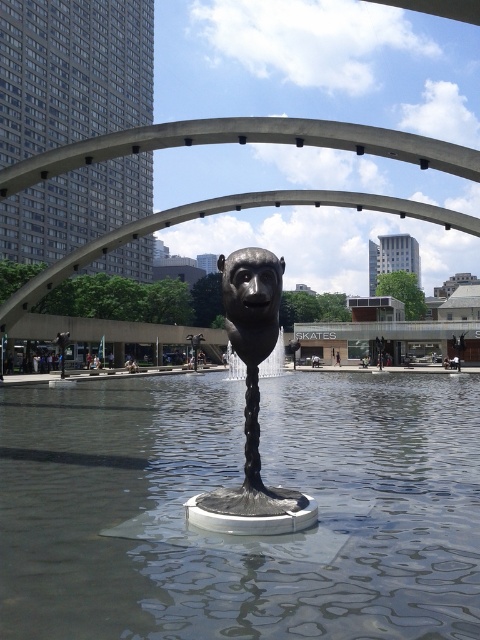
You are an architect planning to install a new light fixture in the plaza. The light fixture requires a minimum of 2 meters of space between it and any nearby objects to avoid obstruction. You want to place it near the shiny bronze sculpture at center and the shiny bronze face at center. Based on their widths, can you determine if placing the light fixture between them would comply with the safety requirement?

The shiny bronze sculpture at center is wider than the shiny bronze face at center. However, the question is about the space between them, not their widths. The provided information does not specify the distance between the two objects, so it is impossible to determine if the 2 meter requirement is met based solely on their widths.

You are a photographer planning to capture the shiny metallic water at center and the shiny bronze sculpture at center in a single frame. Based on their sizes, which object should you focus on to ensure both are clearly visible in your composition?

The shiny metallic water at center is larger in size than the shiny bronze sculpture at center, so focusing on the larger shiny metallic water at center will help ensure both objects are clearly visible in the composition.

You are standing in the urban plaza and want to take a photo of the sculpture. You notice two points marked on the ground at coordinates point (46, 552) and point (267, 529). Which point is closer to you when facing the sculpture?

Point (46, 552) is in front of point (267, 529), so it is closer to you when facing the sculpture.